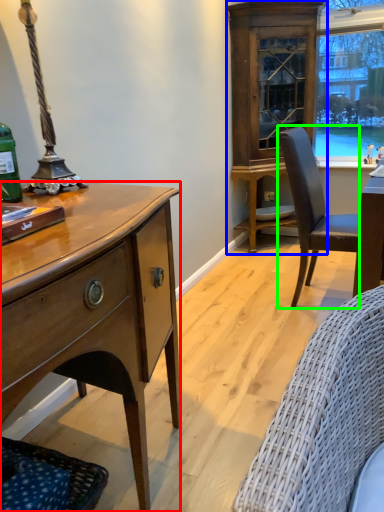
Question: Based on their relative distances, which object is farther from desk (highlighted by a red box)? Choose from cabinetry (highlighted by a blue box) and chair (highlighted by a green box).

Choices:
 (A) cabinetry
 (B) chair

Answer: (A)